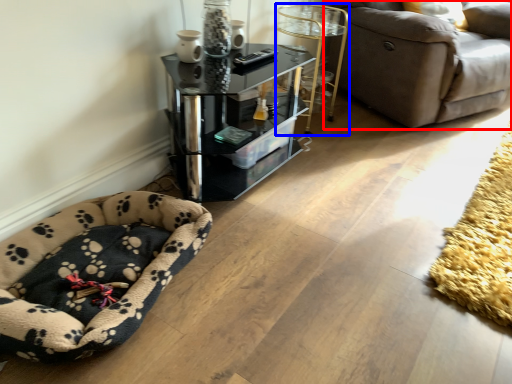
Question: Which point is further to the camera, studio couch (highlighted by a red box) or side table (highlighted by a blue box)?

Choices:
 (A) studio couch
 (B) side table

Answer: (B)